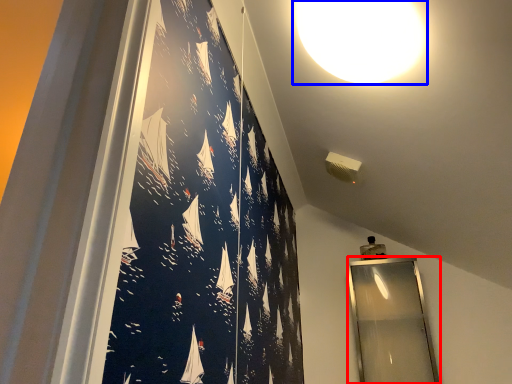
Question: Among these objects, which one is farthest to the camera, mirror (highlighted by a red box) or lamp (highlighted by a blue box)?

Choices:
 (A) mirror
 (B) lamp

Answer: (A)